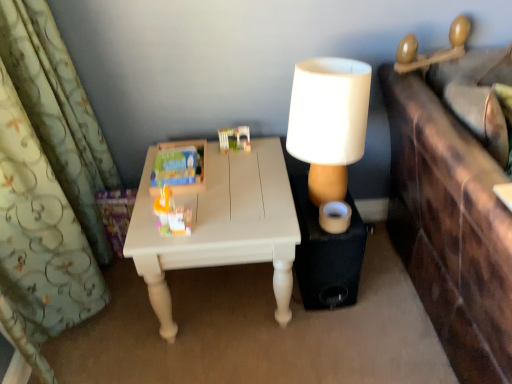
Question: Is plastic building blocks at center, which is counted as the 3th toy, starting from the left, closer to camera compared to matte plastic toy at center, which is the 3th toy in right-to-left order?

Choices:
 (A) no
 (B) yes

Answer: (A)

Question: Is plastic building blocks at center, which is counted as the 3th toy, starting from the left, aimed at matte plastic toy at center, positioned as the 1th toy in left-to-right order?

Choices:
 (A) yes
 (B) no

Answer: (B)

Question: Can you confirm if plastic building blocks at center, which ranks as the first toy in right-to-left order, is bigger than matte plastic toy at center, which is the 3th toy in right-to-left order?

Choices:
 (A) no
 (B) yes

Answer: (A)

Question: Does plastic building blocks at center, which is counted as the 3th toy, starting from the left, have a lesser height compared to matte plastic toy at center, positioned as the 1th toy in left-to-right order?

Choices:
 (A) no
 (B) yes

Answer: (A)

Question: Does plastic building blocks at center, which is counted as the 3th toy, starting from the left, come behind matte plastic toy at center, which is the 3th toy in right-to-left order?

Choices:
 (A) no
 (B) yes

Answer: (B)

Question: Is white matte lampshade at upper right wider or thinner than plastic building blocks at center, which ranks as the first toy in right-to-left order?

Choices:
 (A) thin
 (B) wide

Answer: (B)

Question: Is white matte lampshade at upper right situated inside plastic building blocks at center, which ranks as the first toy in right-to-left order, or outside?

Choices:
 (A) outside
 (B) inside

Answer: (A)

Question: Does point (350, 86) appear closer or farther from the camera than point (229, 129)?

Choices:
 (A) farther
 (B) closer

Answer: (B)

Question: Based on their positions, is white matte lampshade at upper right located to the left or right of plastic building blocks at center, which is counted as the 3th toy, starting from the left?

Choices:
 (A) left
 (B) right

Answer: (B)

Question: Does point (294, 185) appear closer or farther from the camera than point (152, 253)?

Choices:
 (A) farther
 (B) closer

Answer: (A)

Question: From the image's perspective, is black matte speaker at lower right positioned above or below white painted wood table at center?

Choices:
 (A) above
 (B) below

Answer: (B)

Question: Which is correct: black matte speaker at lower right is inside white painted wood table at center, or outside of it?

Choices:
 (A) outside
 (B) inside

Answer: (A)

Question: Visually, is black matte speaker at lower right positioned to the left or to the right of white painted wood table at center?

Choices:
 (A) left
 (B) right

Answer: (B)

Question: In the image, is black matte speaker at lower right positioned in front of or behind green floral fabric curtain at left?

Choices:
 (A) front
 (B) behind

Answer: (B)

Question: Considering the positions of black matte speaker at lower right and green floral fabric curtain at left in the image, is black matte speaker at lower right bigger or smaller than green floral fabric curtain at left?

Choices:
 (A) big
 (B) small

Answer: (B)